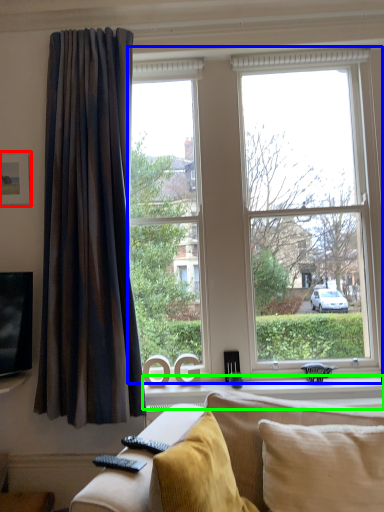
Question: Estimate the real-world distances between objects in this image. Which object is closer to picture frame (highlighted by a red box), window (highlighted by a blue box) or window sill (highlighted by a green box)?

Choices:
 (A) window
 (B) window sill

Answer: (A)